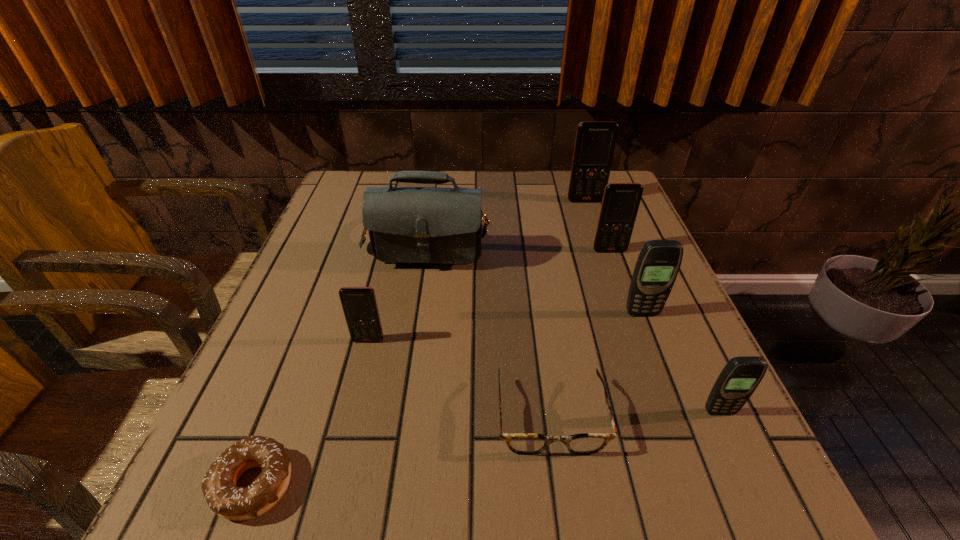
At what (x,y) coordinates should I click in order to perform the action: click on the farthest orange cellular telephone. Please return your answer as a coordinate pair (x, y). Looking at the image, I should click on (595, 143).

The width and height of the screenshot is (960, 540). In order to click on the biggest orange cellular telephone in this screenshot , I will do `click(595, 143)`.

This screenshot has width=960, height=540. What are the coordinates of `shoulder bag` in the screenshot? It's located at (438, 225).

Find the location of `the third farthest cellular telephone`. the third farthest cellular telephone is located at coordinates (658, 264).

The height and width of the screenshot is (540, 960). Find the location of `the bigger gray cellular telephone`. the bigger gray cellular telephone is located at coordinates (658, 264).

Find the location of a particular element. This screenshot has width=960, height=540. the second biggest orange cellular telephone is located at coordinates (x=620, y=204).

Image resolution: width=960 pixels, height=540 pixels. Identify the location of the second farthest orange cellular telephone. (620, 204).

In order to click on the smallest orange cellular telephone in this screenshot , I will do `click(359, 304)`.

Locate an element on the screen. the fifth farthest object is located at coordinates (359, 304).

Identify the location of the nearer gray cellular telephone. (738, 380).